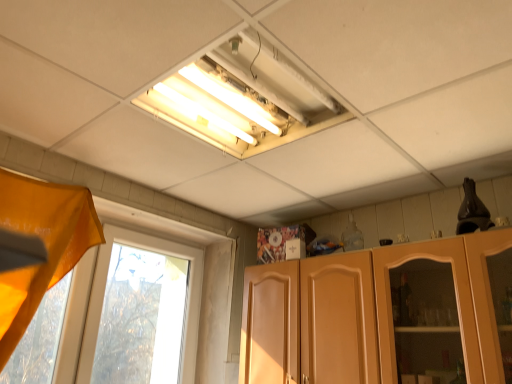
Question: Should I look upward or downward to see transparent glass window at left?

Choices:
 (A) down
 (B) up

Answer: (A)

Question: Is orange fabric curtain at left not within matte wood cabinet at lower right?

Choices:
 (A) no
 (B) yes

Answer: (B)

Question: From the image's perspective, is orange fabric curtain at left over matte wood cabinet at lower right?

Choices:
 (A) no
 (B) yes

Answer: (B)

Question: From the image's perspective, is orange fabric curtain at left beneath matte wood cabinet at lower right?

Choices:
 (A) yes
 (B) no

Answer: (B)

Question: Can you confirm if orange fabric curtain at left is shorter than matte wood cabinet at lower right?

Choices:
 (A) no
 (B) yes

Answer: (A)

Question: Could you tell me if orange fabric curtain at left is turned towards matte wood cabinet at lower right?

Choices:
 (A) no
 (B) yes

Answer: (A)

Question: Would you say orange fabric curtain at left is a long distance from matte wood cabinet at lower right?

Choices:
 (A) yes
 (B) no

Answer: (A)

Question: From a real-world perspective, is orange fabric curtain at left under transparent glass window at left?

Choices:
 (A) no
 (B) yes

Answer: (A)

Question: From a real-world perspective, is orange fabric curtain at left on transparent glass window at left?

Choices:
 (A) no
 (B) yes

Answer: (B)

Question: Considering the relative sizes of orange fabric curtain at left and transparent glass window at left in the image provided, is orange fabric curtain at left wider than transparent glass window at left?

Choices:
 (A) yes
 (B) no

Answer: (A)

Question: Is the position of orange fabric curtain at left less distant than that of transparent glass window at left?

Choices:
 (A) no
 (B) yes

Answer: (B)

Question: From the image's perspective, does orange fabric curtain at left appear lower than transparent glass window at left?

Choices:
 (A) no
 (B) yes

Answer: (A)

Question: Considering the relative sizes of orange fabric curtain at left and transparent glass window at left in the image provided, is orange fabric curtain at left shorter than transparent glass window at left?

Choices:
 (A) yes
 (B) no

Answer: (B)

Question: Considering the relative sizes of transparent glass window at left and matte wood cabinet at lower right in the image provided, is transparent glass window at left thinner than matte wood cabinet at lower right?

Choices:
 (A) yes
 (B) no

Answer: (A)